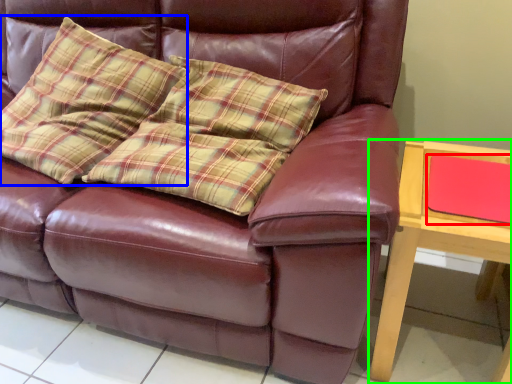
Question: Based on their relative distances, which object is nearer to pad (highlighted by a red box)? Choose from throw pillow (highlighted by a blue box) and table (highlighted by a green box).

Choices:
 (A) throw pillow
 (B) table

Answer: (B)